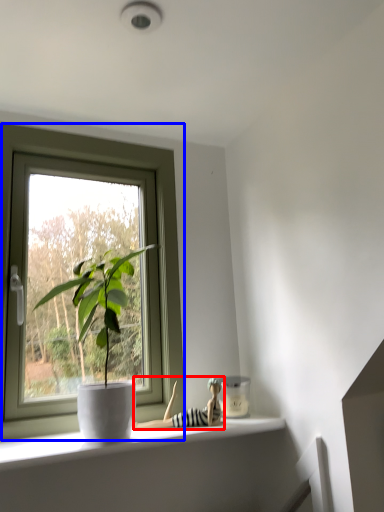
Question: Among these objects, which one is nearest to the camera, toy (highlighted by a red box) or window (highlighted by a blue box)?

Choices:
 (A) toy
 (B) window

Answer: (B)